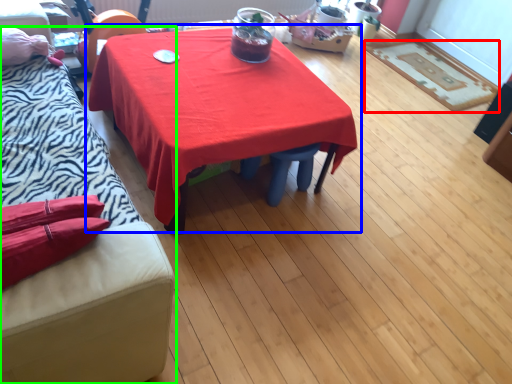
Question: Which object is the closest to the mat (highlighted by a red box)? Choose among these: table (highlighted by a blue box) or studio couch (highlighted by a green box).

Choices:
 (A) table
 (B) studio couch

Answer: (A)